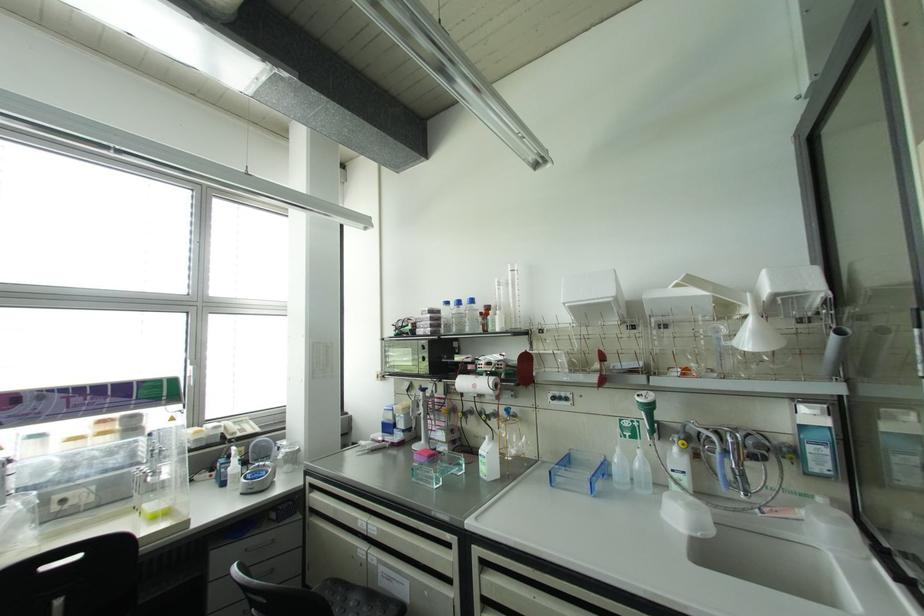
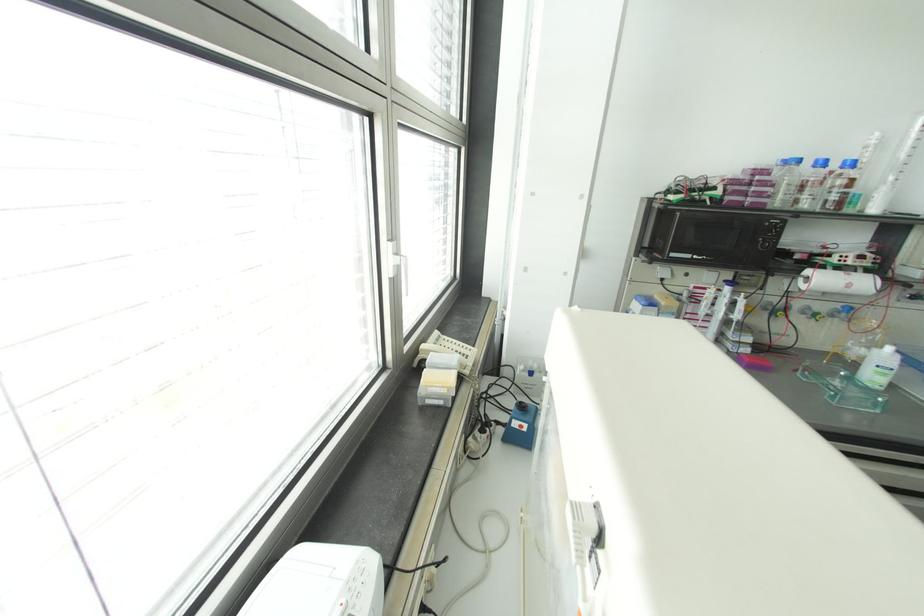
The point at (491, 445) is marked in the first image. Where is the corresponding point in the second image?

(898, 355)